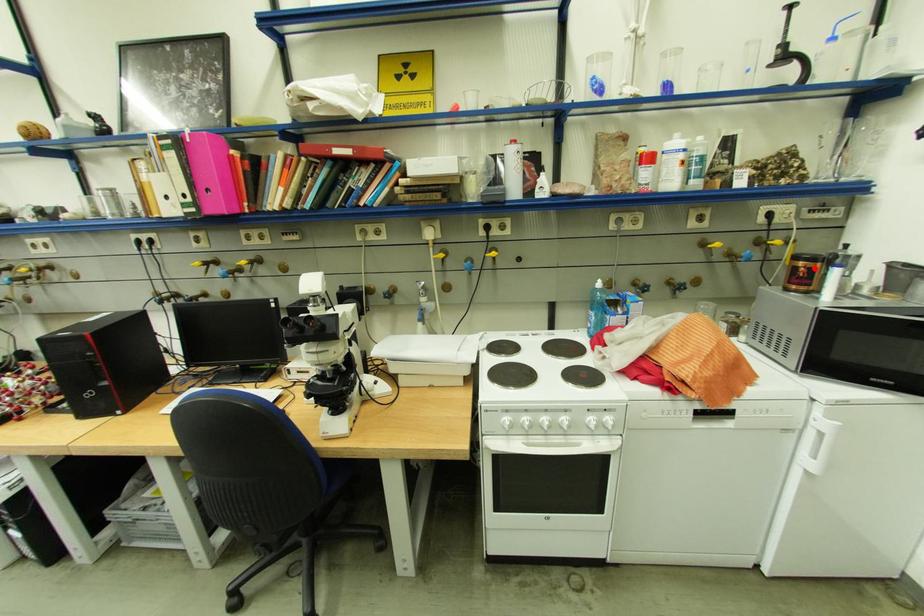
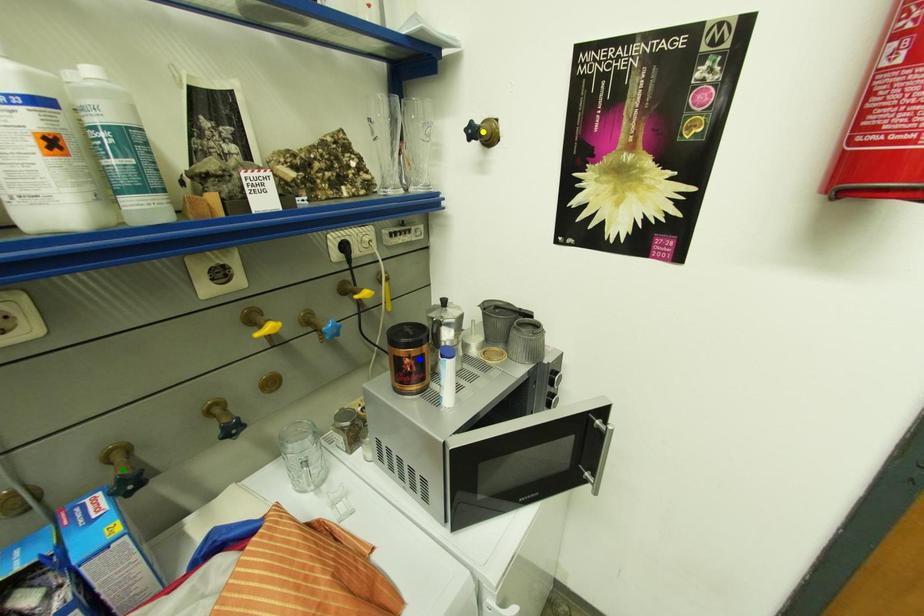
Question: I am providing you with two images of the same scene from different viewpoints. A red point is marked on the first image. You are given multiple points on the second image. In image 2, which mark is for the same physical point as the one in image 1?

Choices:
 (A) blue point
 (B) yellow point
 (C) green point

Answer: (A)